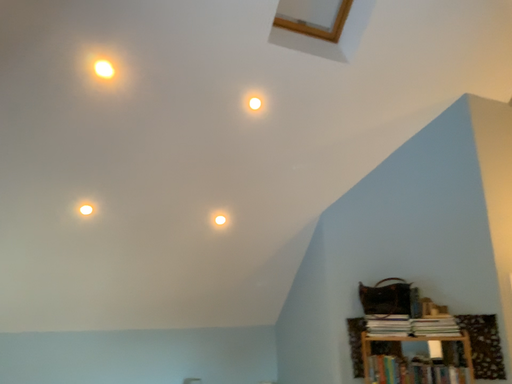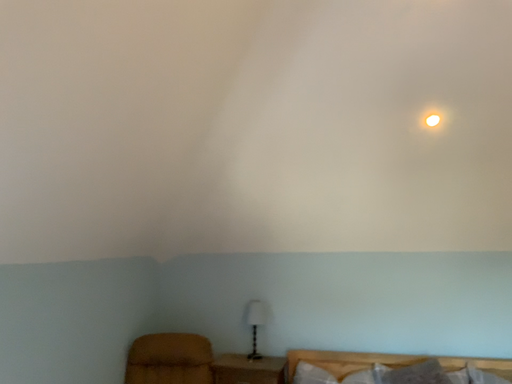
Question: Which way did the camera rotate in the video?

Choices:
 (A) rotated downward
 (B) rotated upward

Answer: (A)